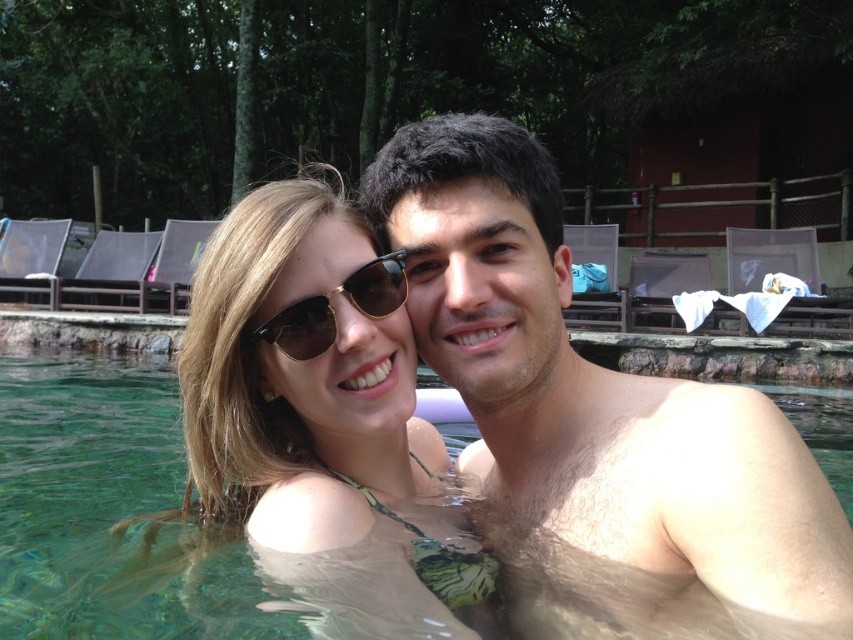
Question: Does clear glass water at center have a greater width compared to matte gold sunglasses at center?

Choices:
 (A) no
 (B) yes

Answer: (A)

Question: Which is farther from the matte gold sunglasses at center?

Choices:
 (A) clear glass water at center
 (B) gold-framed sunglasses at center

Answer: (A)

Question: Is smooth skin man at center positioned at the back of clear glass water at center?

Choices:
 (A) no
 (B) yes

Answer: (A)

Question: Which of the following is the farthest from the observer?

Choices:
 (A) (633, 534)
 (B) (300, 339)
 (C) (279, 531)

Answer: (C)

Question: Does clear glass water at center lie in front of matte gold sunglasses at center?

Choices:
 (A) no
 (B) yes

Answer: (A)

Question: Which object is positioned farthest from the matte gold sunglasses at center?

Choices:
 (A) clear glass water at center
 (B) gold-framed sunglasses at center

Answer: (A)